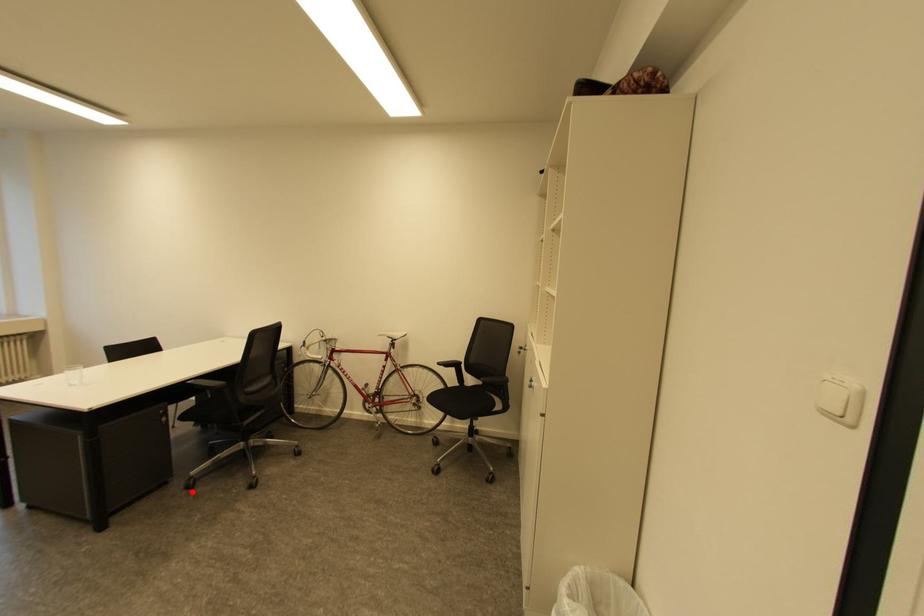
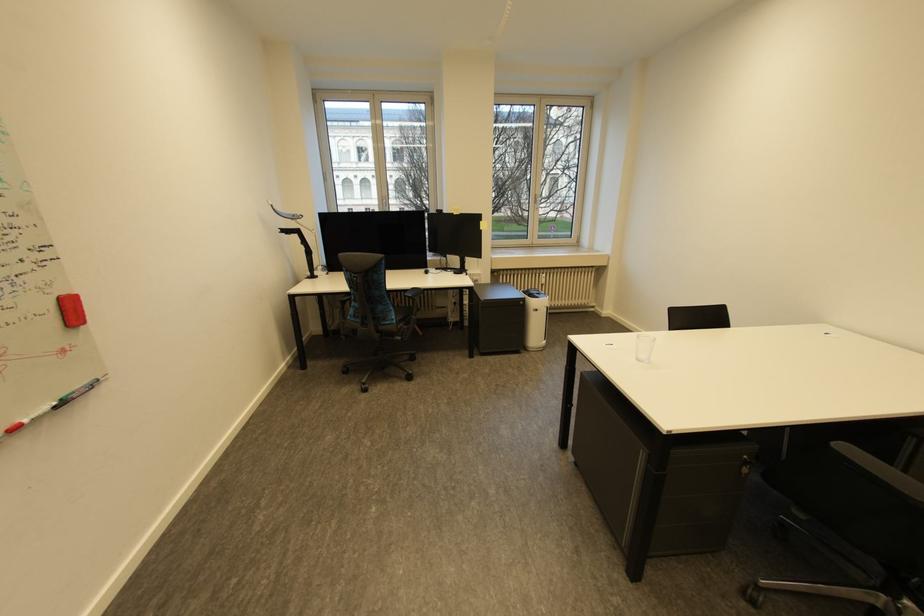
In the second image, find the point that corresponds to the highlighted location in the first image.

(750, 604)